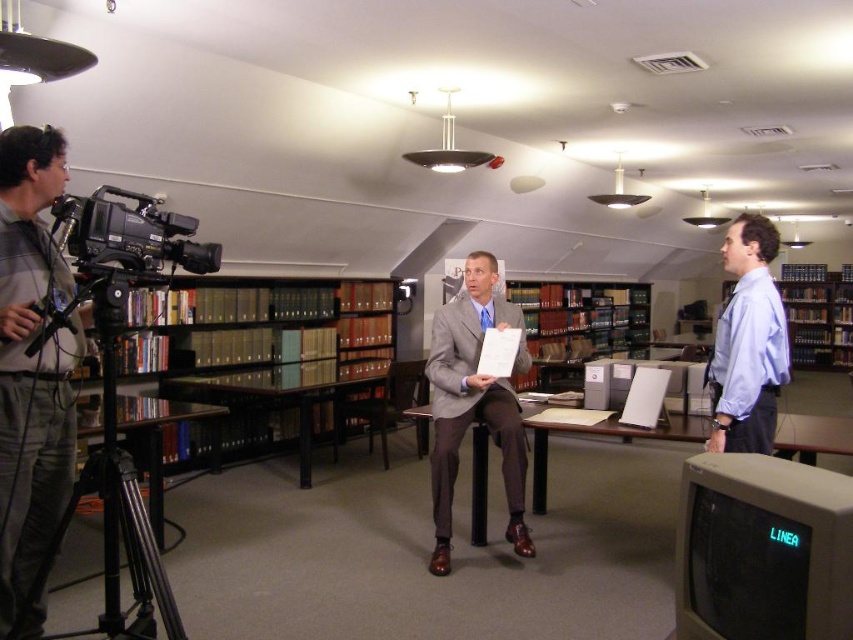
Question: Is matte gray suit at center wider than black metal table at center?

Choices:
 (A) no
 (B) yes

Answer: (A)

Question: Which point is closer to the camera taking this photo?

Choices:
 (A) (218, 257)
 (B) (457, 419)
 (C) (310, 390)

Answer: (A)

Question: Is black metal table at center bigger than wooden desk at center?

Choices:
 (A) yes
 (B) no

Answer: (B)

Question: Estimate the real-world distances between objects in this image. Which object is closer to the light blue shirt at right?

Choices:
 (A) gray fabric shirt at left
 (B) brown wooden bookshelf at right
 (C) black metal table at center
 (D) matte gray suit at center

Answer: (D)

Question: Is brown wooden bookshelf at center bigger than black glass table at lower left?

Choices:
 (A) yes
 (B) no

Answer: (A)

Question: Which object is farther from the camera taking this photo?

Choices:
 (A) brown wooden bookcase at center
 (B) brown wooden bookshelf at center

Answer: (B)